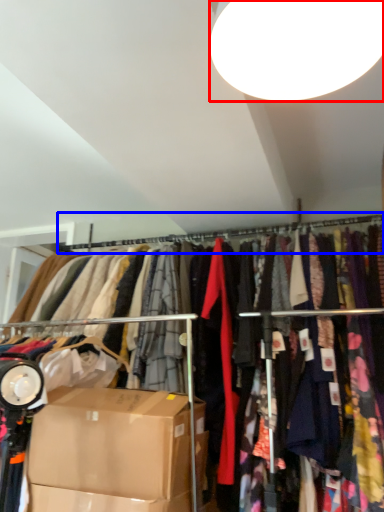
Question: Among these objects, which one is farthest to the camera, lamp (highlighted by a red box) or clothesline (highlighted by a blue box)?

Choices:
 (A) lamp
 (B) clothesline

Answer: (B)